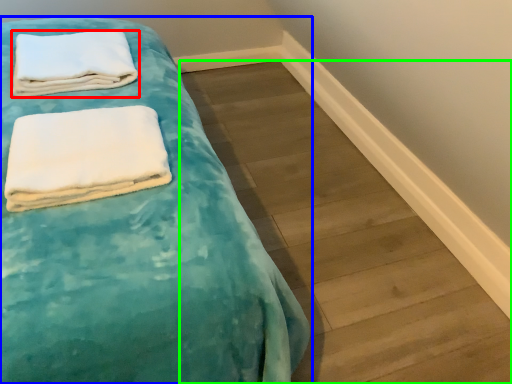
Question: Considering the real-world distances, which object is closest to towel (highlighted by a red box)? bed (highlighted by a blue box) or plank (highlighted by a green box).

Choices:
 (A) bed
 (B) plank

Answer: (A)